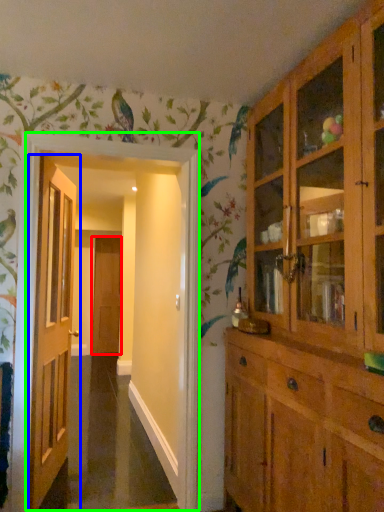
Question: Which object is the closest to the door (highlighted by a red box)? Choose among these: door (highlighted by a blue box) or corridor (highlighted by a green box).

Choices:
 (A) door
 (B) corridor

Answer: (A)